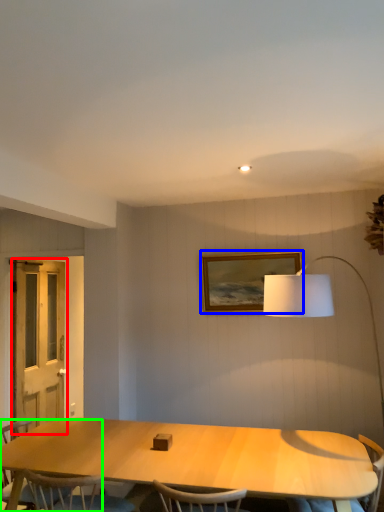
Question: Which is nearer to the screen door (highlighted by a red box)? picture frame (highlighted by a blue box) or chair (highlighted by a green box).

Choices:
 (A) picture frame
 (B) chair

Answer: (B)